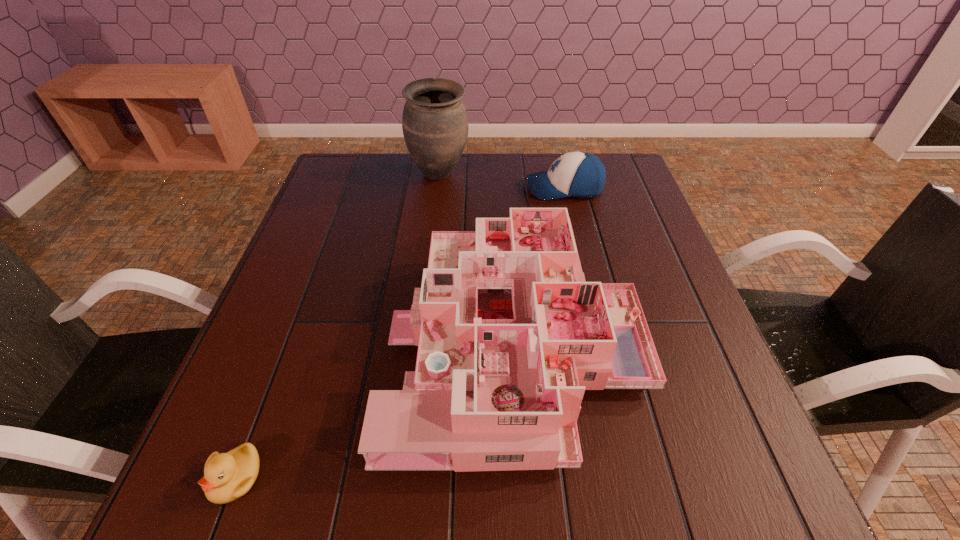
Identify the location of urn. (435, 127).

Where is `the third shortest object`? the third shortest object is located at coordinates (510, 335).

This screenshot has height=540, width=960. Identify the location of the second shortest object. (579, 174).

Where is `duckling`? duckling is located at coordinates (227, 476).

At what (x,y) coordinates should I click in order to perform the action: click on the shortest object. Please return your answer as a coordinate pair (x, y). This screenshot has width=960, height=540. Looking at the image, I should click on (227, 476).

Where is `vacant area situated on the right of the tallest object`? This screenshot has width=960, height=540. vacant area situated on the right of the tallest object is located at coordinates (503, 174).

Where is `vacant space located 0.250m at the front entrance of the second tallest object`? vacant space located 0.250m at the front entrance of the second tallest object is located at coordinates (269, 339).

Locate an element on the screen. vacant space located 0.180m at the front entrance of the second tallest object is located at coordinates (303, 339).

Image resolution: width=960 pixels, height=540 pixels. Identify the location of vacant space located on the front-facing side of the baseball cap. (468, 188).

The width and height of the screenshot is (960, 540). Identify the location of free location located on the front-facing side of the baseball cap. (485, 188).